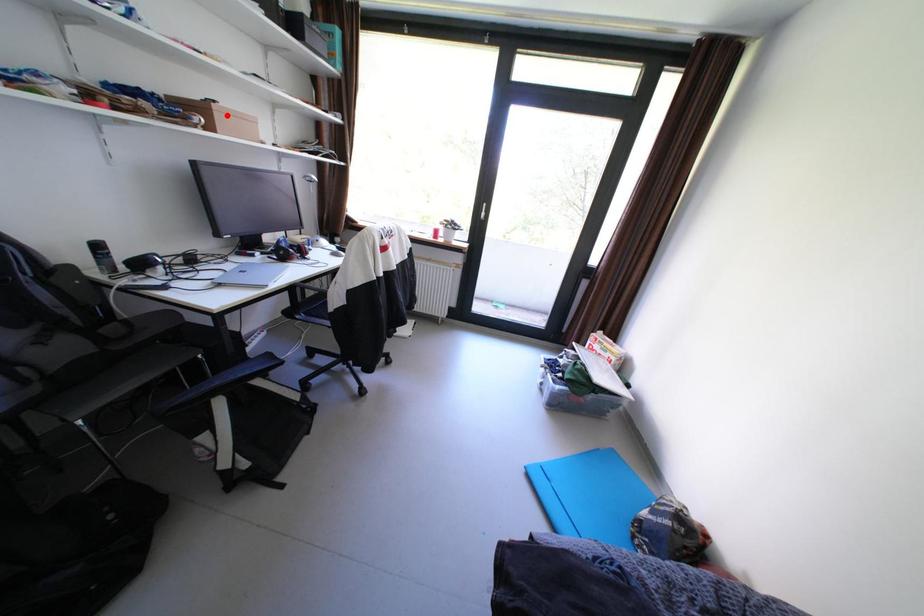
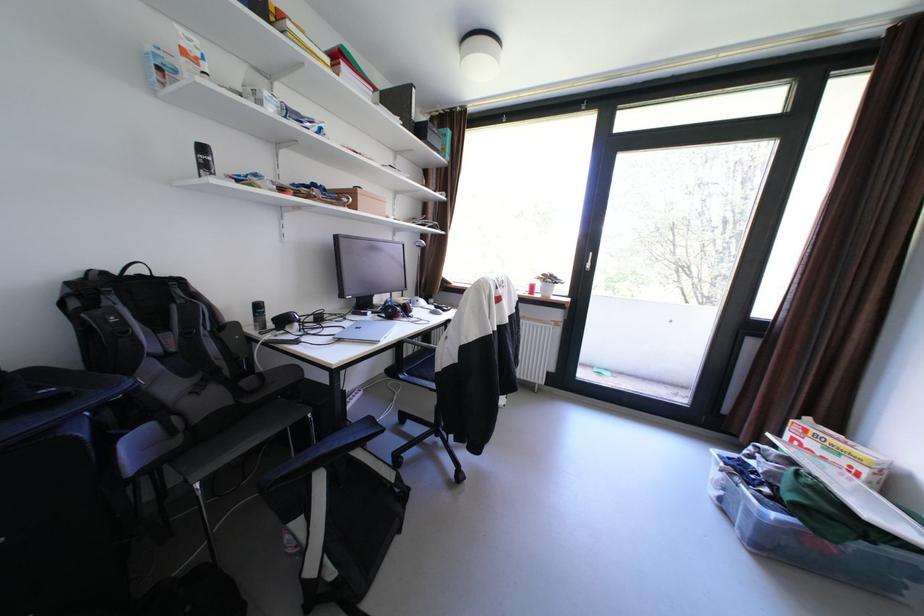
Where in the second image is the point corresponding to the highlighted location from the first image?

(370, 197)